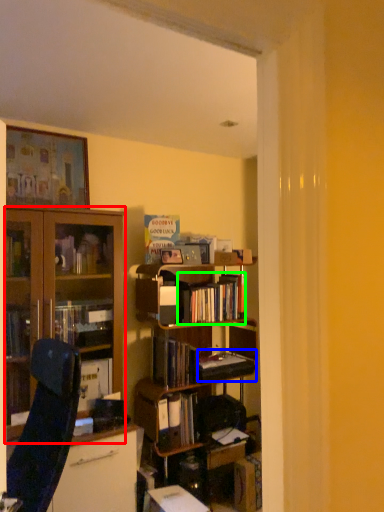
Question: Which object is the closest to the cabinetry (highlighted by a red box)? Choose among these: paperback book (highlighted by a blue box) or book (highlighted by a green box).

Choices:
 (A) paperback book
 (B) book

Answer: (B)